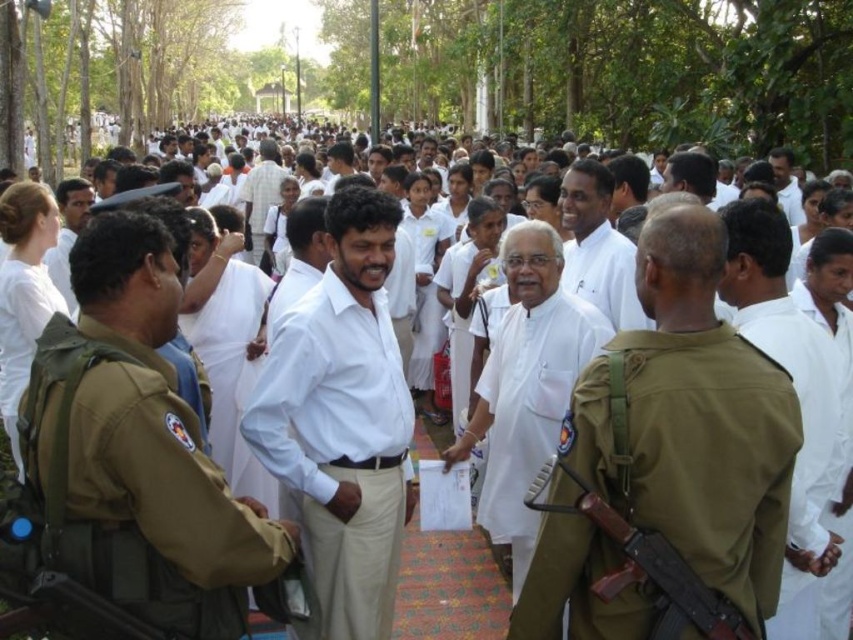
Can you confirm if white cloth at center is positioned above white cloth shirt at center?

No.

I want to click on white cloth at center, so click(796, 394).

Image resolution: width=853 pixels, height=640 pixels. In order to click on white cloth at center in this screenshot , I will do `click(796, 394)`.

The height and width of the screenshot is (640, 853). In order to click on white cloth at center in this screenshot , I will do `click(796, 394)`.

Who is more forward, (787, 605) or (630, 545)?

Positioned in front is point (630, 545).

How distant is white cloth at center from wooden brown rifle at center?

white cloth at center and wooden brown rifle at center are 2.93 meters apart from each other.

Does point (787, 552) lie behind point (566, 467)?

Yes, it is behind point (566, 467).

Where is `white cloth at center`? white cloth at center is located at coordinates (796, 394).

This screenshot has height=640, width=853. I want to click on white cotton kurta at center, so click(x=526, y=385).

Which is behind, point (506, 326) or point (612, 289)?

The point (612, 289) is behind.

Identify the location of white cotton kurta at center. Image resolution: width=853 pixels, height=640 pixels. (526, 385).